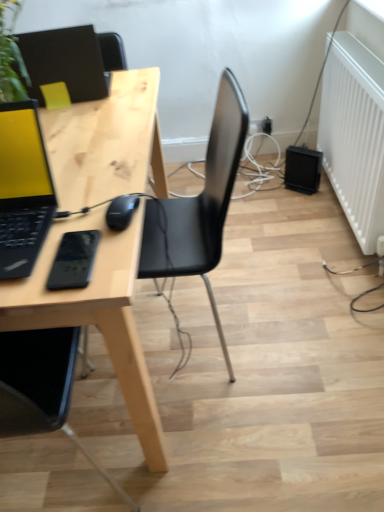
Find the location of a particular element. This screenshot has height=512, width=384. free space on the front side of matte black laptop at upper left, placed as the second laptop when sorted from bottom to top is located at coordinates (87, 114).